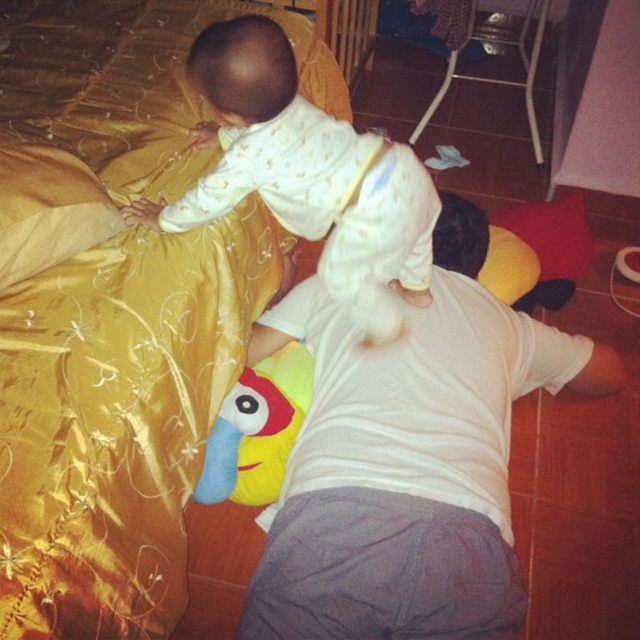
Does white cotton shirt at center appear on the left side of soft plush toy at center?

Incorrect, white cotton shirt at center is not on the left side of soft plush toy at center.

Is point (296, 477) positioned after point (260, 413)?

No, (296, 477) is in front of (260, 413).

This screenshot has height=640, width=640. Find the location of `white cotton shirt at center`. white cotton shirt at center is located at coordinates (410, 460).

Does gold satin bed at upper left appear on the right side of white soft onesie at upper center?

No, gold satin bed at upper left is not to the right of white soft onesie at upper center.

Can you confirm if gold satin bed at upper left is positioned below white soft onesie at upper center?

Indeed, gold satin bed at upper left is positioned under white soft onesie at upper center.

Which is in front, point (40, 376) or point (259, 60)?

Point (40, 376) is more forward.

Find the location of a particular element. This screenshot has width=640, height=640. gold satin bed at upper left is located at coordinates (116, 308).

Does gold satin bed at upper left have a larger size compared to white cotton shirt at center?

Yes, gold satin bed at upper left is bigger than white cotton shirt at center.

Is point (19, 593) positioned behind point (408, 477)?

No, it is in front of (408, 477).

Image resolution: width=640 pixels, height=640 pixels. I want to click on gold satin bed at upper left, so click(x=116, y=308).